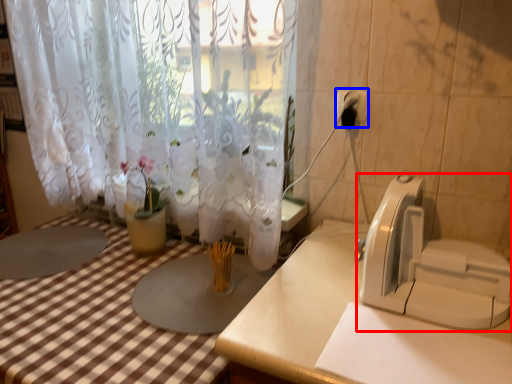
Question: Which object appears farthest to the camera in this image, appliance (highlighted by a red box) or electric outlet (highlighted by a blue box)?

Choices:
 (A) appliance
 (B) electric outlet

Answer: (B)